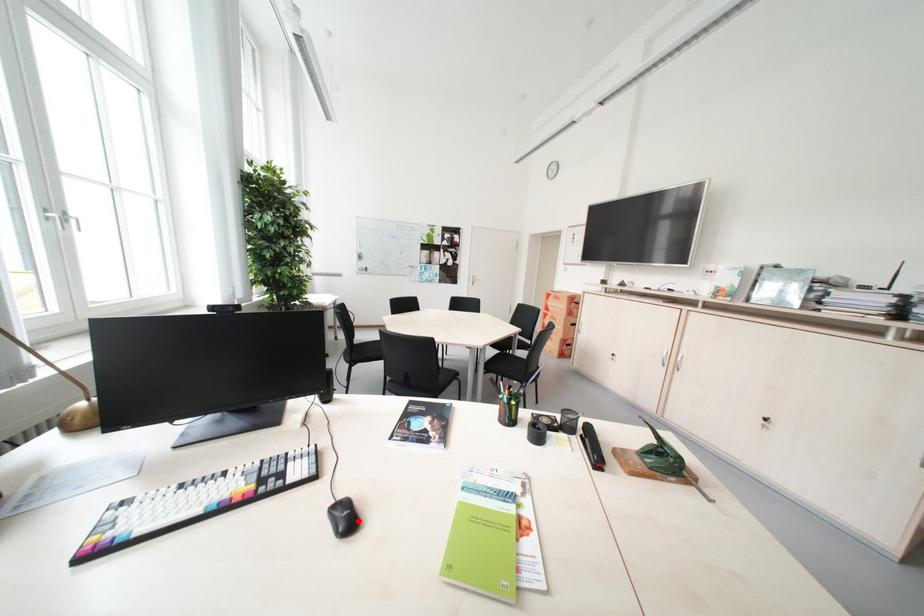
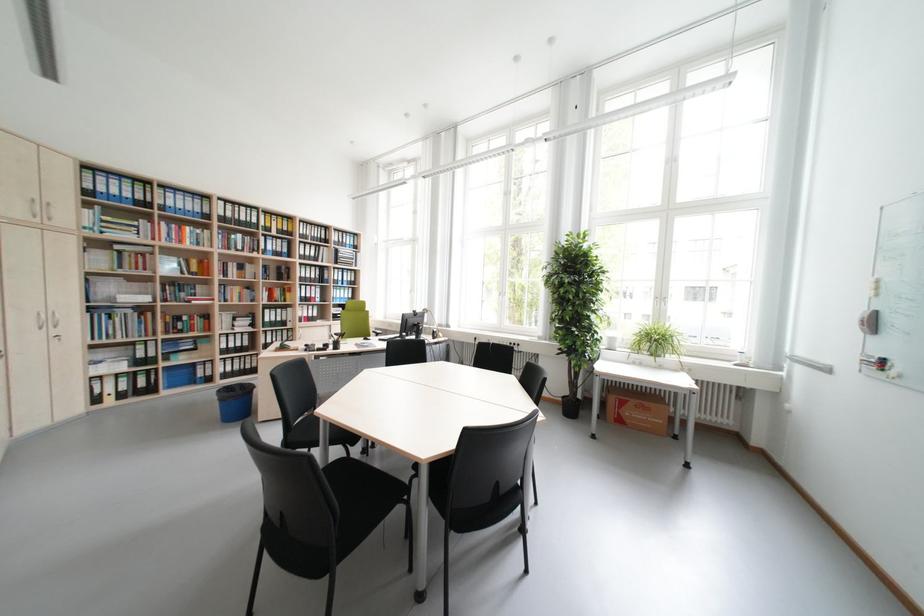
Question: I am providing you with two images of the same scene from different viewpoints. A red point is marked on the first image. Is the red point's position out of view in image 2?

Choices:
 (A) Yes
 (B) No

Answer: (A)